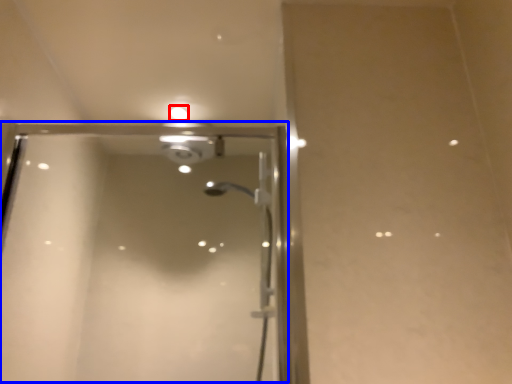
Question: Among these objects, which one is farthest to the camera, droplight (highlighted by a red box) or screen door (highlighted by a blue box)?

Choices:
 (A) droplight
 (B) screen door

Answer: (A)